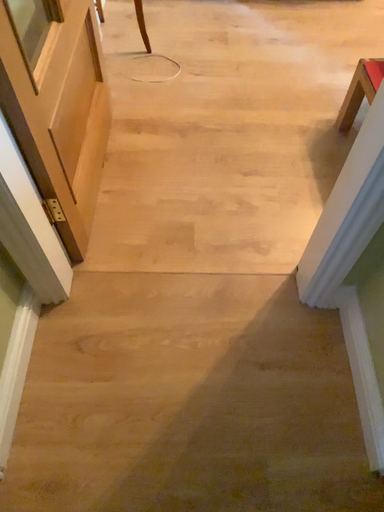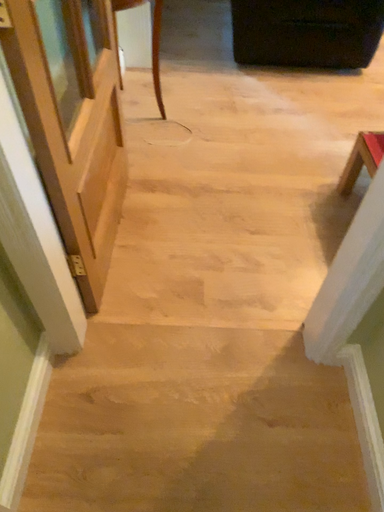
Question: How did the camera likely rotate when shooting the video?

Choices:
 (A) rotated upward
 (B) rotated downward

Answer: (A)